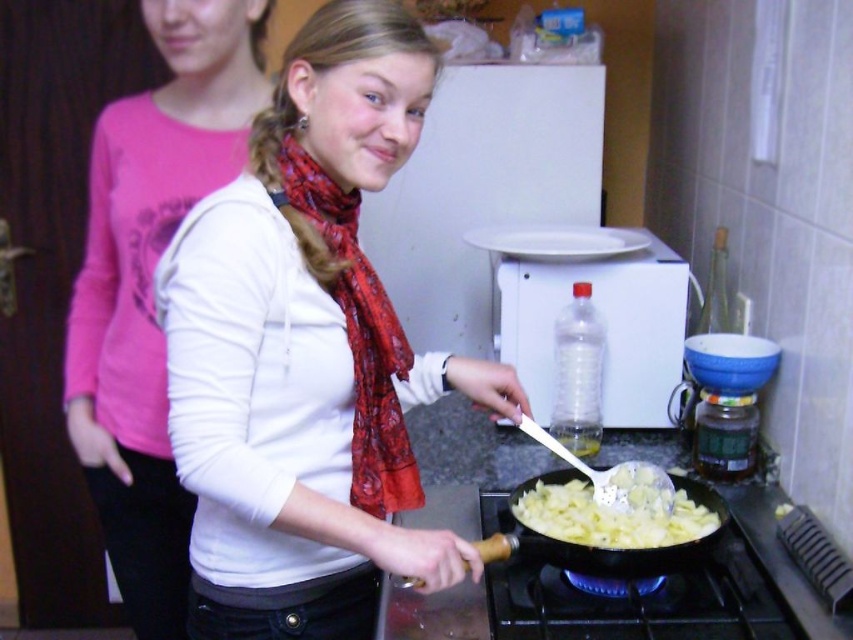
Question: Which point is closer to the camera taking this photo?

Choices:
 (A) (631, 556)
 (B) (657, 632)

Answer: (A)

Question: Which point is farther to the camera?

Choices:
 (A) (263, 499)
 (B) (583, 568)

Answer: (B)

Question: Among these objects, which one is nearest to the camera?

Choices:
 (A) wooden handle pan at center
 (B) blue flame gas stove at lower center
 (C) white matte scarf at center
 (D) pink fabric shirt at left

Answer: (C)

Question: Is white matte scarf at center below wooden handle pan at center?

Choices:
 (A) no
 (B) yes

Answer: (A)

Question: Observing the image, what is the correct spatial positioning of blue flame gas stove at lower center in reference to wooden handle pan at center?

Choices:
 (A) left
 (B) right

Answer: (B)

Question: Can you confirm if blue flame gas stove at lower center is positioned to the right of wooden handle pan at center?

Choices:
 (A) no
 (B) yes

Answer: (B)